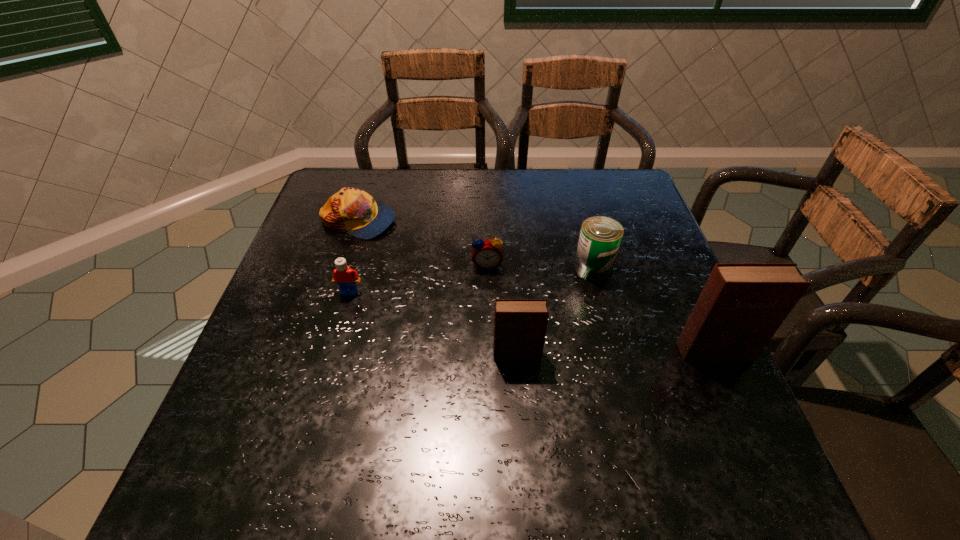
You are a GUI agent. You are given a task and a screenshot of the screen. Output one action in this format:
    pyautogui.click(x=<x>, y=<y>)
    Task: Click on the free point that keeps the diarys evenly spaced on the left
    The width and height of the screenshot is (960, 540).
    Given the screenshot: What is the action you would take?
    pyautogui.click(x=317, y=358)